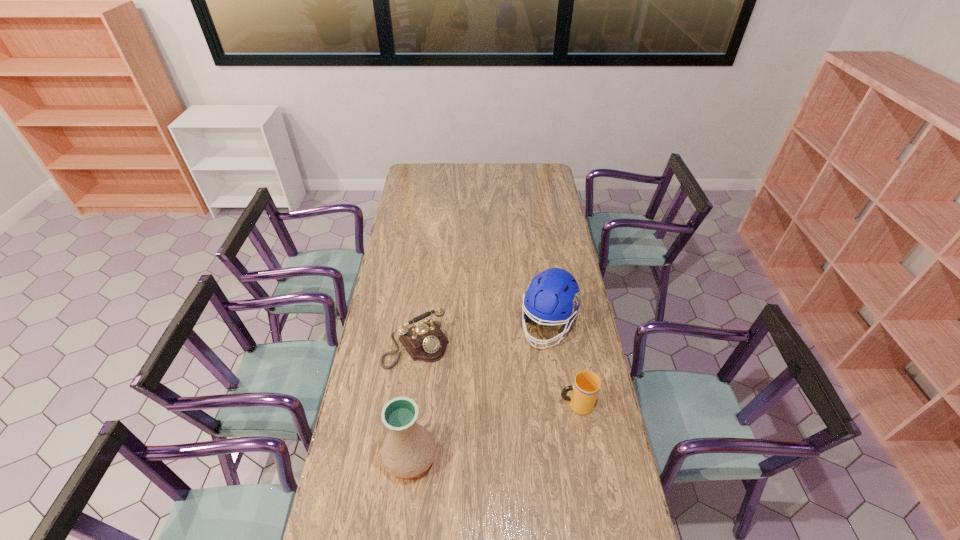
Where is `free space at the left edge of the desktop`? This screenshot has width=960, height=540. free space at the left edge of the desktop is located at coordinates (402, 214).

In the image, there is a desktop. At what (x,y) coordinates should I click in order to perform the action: click on vacant area at the right edge. Please return your answer as a coordinate pair (x, y). Looking at the image, I should click on (563, 209).

I want to click on free region at the far left corner of the desktop, so click(x=410, y=171).

The height and width of the screenshot is (540, 960). Find the location of `vacant space at the far right corner of the desktop`. vacant space at the far right corner of the desktop is located at coordinates (534, 175).

I want to click on vacant space that's between the football helmet and the second nearest object, so click(563, 365).

Find the location of `vacant area between the football helmet and the third farthest object`. vacant area between the football helmet and the third farthest object is located at coordinates (563, 365).

What are the coordinates of `vacant space that's between the football helmet and the telephone` in the screenshot? It's located at (482, 335).

Find the location of a particular element. Image resolution: width=960 pixels, height=540 pixels. vacant space in between the football helmet and the pottery is located at coordinates (479, 392).

The image size is (960, 540). Find the location of `vacant region between the telephone and the football helmet`. vacant region between the telephone and the football helmet is located at coordinates (482, 335).

You are a GUI agent. You are given a task and a screenshot of the screen. Output one action in this format:
    pyautogui.click(x=<x>, y=<y>)
    Task: Click on the free space between the cup and the nearest object
    
    Given the screenshot: What is the action you would take?
    pyautogui.click(x=493, y=431)